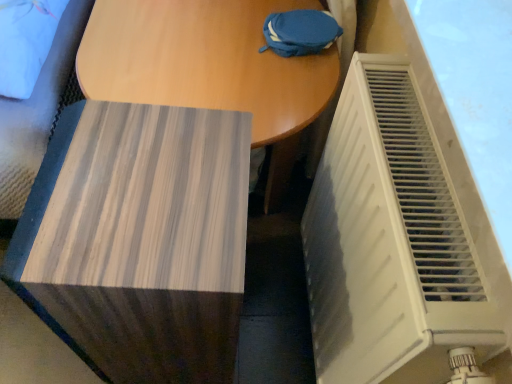
At what (x,y) coordinates should I click in order to perform the action: click on vacant space situated above wooden side table at lower left (from a real-world perspective). Please return your answer as a coordinate pair (x, y). The width and height of the screenshot is (512, 384). Looking at the image, I should click on (129, 194).